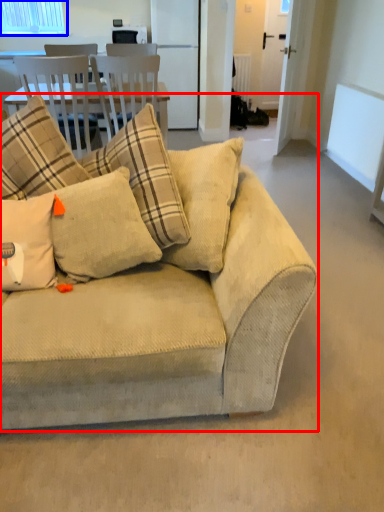
Question: Which object is closer to the camera taking this photo, studio couch (highlighted by a red box) or window (highlighted by a blue box)?

Choices:
 (A) studio couch
 (B) window

Answer: (A)